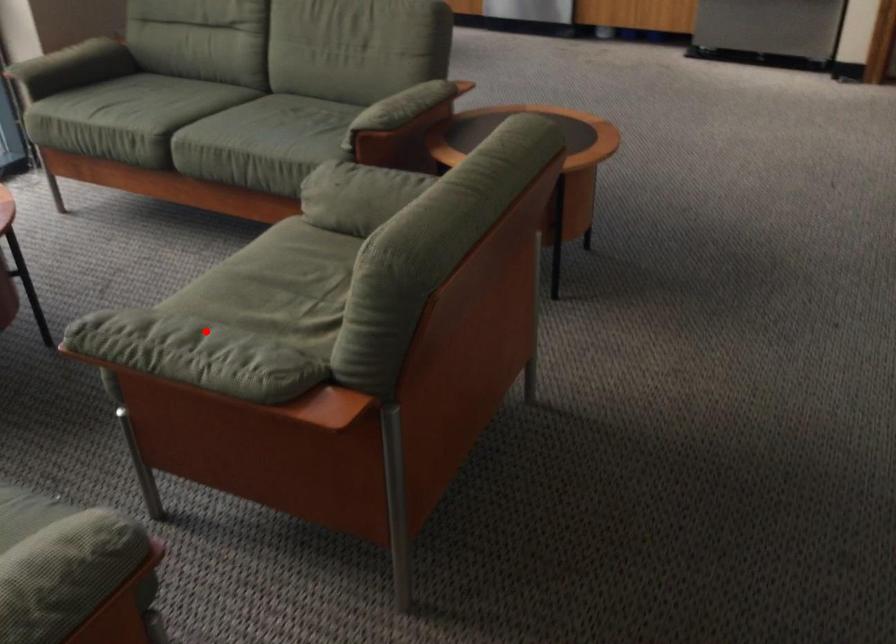
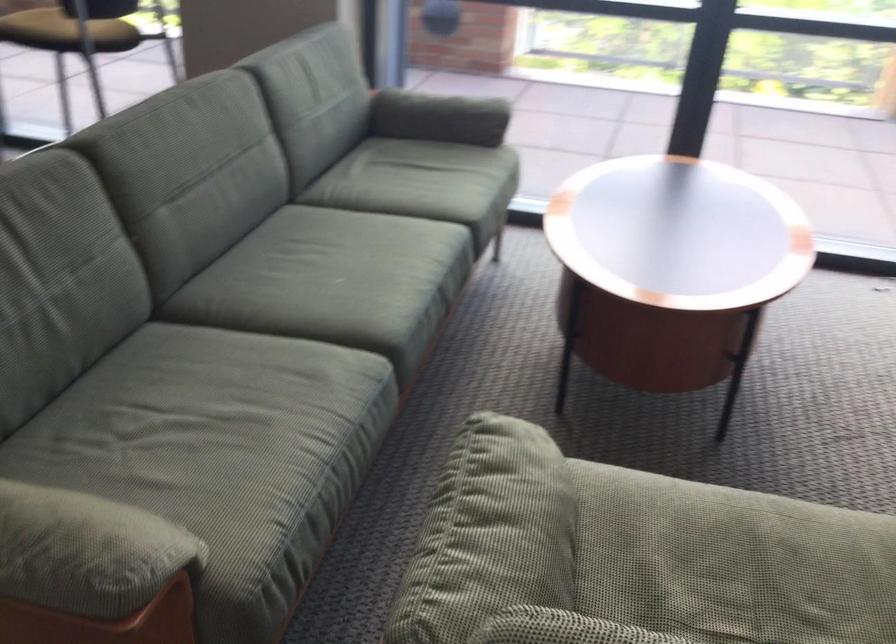
Question: I am providing you with two images of the same scene from different viewpoints. Given a red point in image1, look at the same physical point in image2. Is it:

Choices:
 (A) Closer to the viewpoint
 (B) Farther from the viewpoint

Answer: (A)